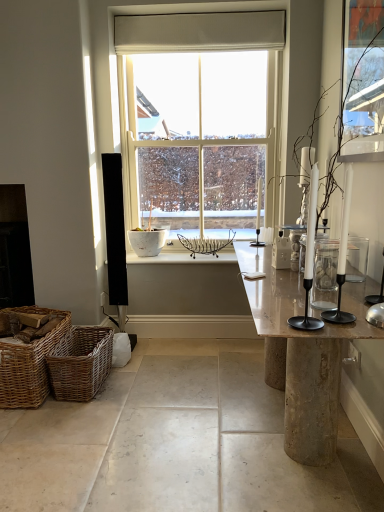
At what (x,y) coordinates should I click in order to perform the action: click on vacant region in front of clear glass jar at right. Please return your answer as a coordinate pair (x, y). Image resolution: width=384 pixels, height=512 pixels. Looking at the image, I should click on (332, 302).